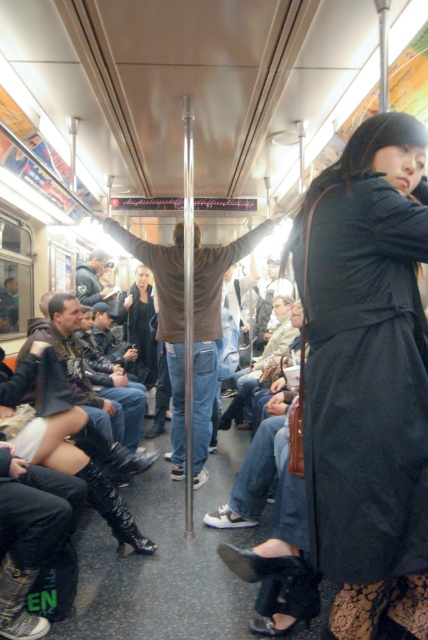
Based on the photo, you are a passenger in the subway car and want to know which item is higher between the black matte coat at center and the brown leather jacket at center. Which one is higher?

The black matte coat at center is higher than the brown leather jacket at center.

You are a passenger in the subway car and want to know which clothing item is shorter between the black matte coat at center and the brown leather jacket at center. Which one should you point out?

The black matte coat at center is shorter than the brown leather jacket at center.

You are a passenger in the subway car and notice two coats at the center. Which coat is closer to you, the black matte coat at center or the brown leather jacket at center?

The black matte coat at center is closer to you because it is in front of the brown leather jacket at center.